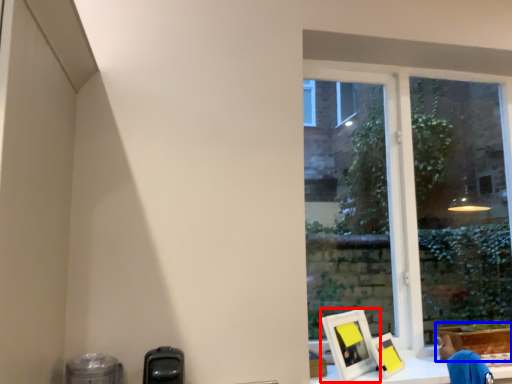
Question: Which object appears farthest to the camera in this image, picture frame (highlighted by a red box) or cardboard box (highlighted by a blue box)?

Choices:
 (A) picture frame
 (B) cardboard box

Answer: (B)